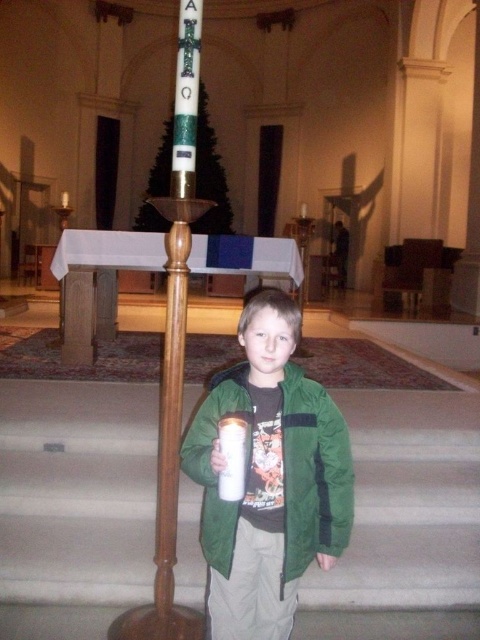
Can you confirm if wooden pole at center is wider than white frosted glass at center?

Correct, the width of wooden pole at center exceeds that of white frosted glass at center.

Is point (173, 141) positioned before point (231, 465)?

No, it is behind (231, 465).

Locate an element on the screen. wooden pole at center is located at coordinates (177, 326).

Measure the distance between smooth beige stairs at center and camera.

The distance of smooth beige stairs at center from camera is 8.95 feet.

The width and height of the screenshot is (480, 640). I want to click on smooth beige stairs at center, so click(76, 492).

Looking at this image, who is positioned more to the left, smooth beige stairs at center or wooden pole at center?

smooth beige stairs at center

Is smooth beige stairs at center below wooden pole at center?

Yes.

This screenshot has width=480, height=640. What do you see at coordinates (76, 492) in the screenshot?
I see `smooth beige stairs at center` at bounding box center [76, 492].

Image resolution: width=480 pixels, height=640 pixels. Find the location of `smooth beige stairs at center`. smooth beige stairs at center is located at coordinates pyautogui.click(x=76, y=492).